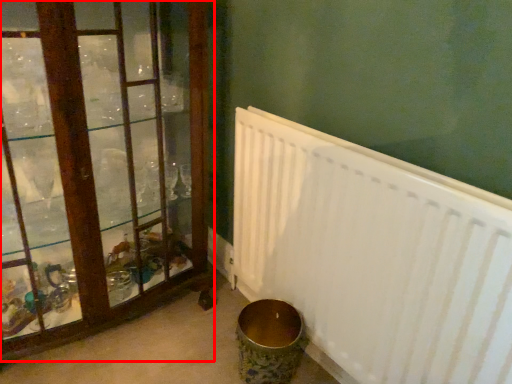
Question: In this image, where is window (annotated by the red box) located relative to radiator?

Choices:
 (A) left
 (B) right

Answer: (A)